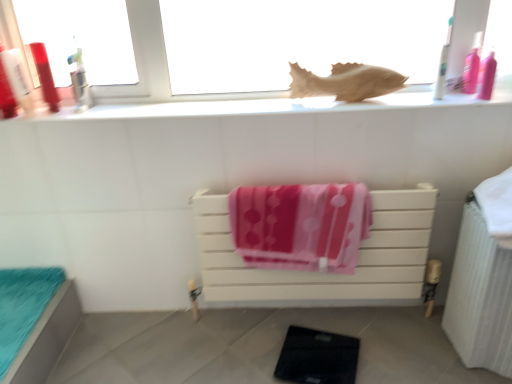
Identify the location of free point below white wooden towel rack at center, the second furniture from the left (from a real-world perspective). (298, 311).